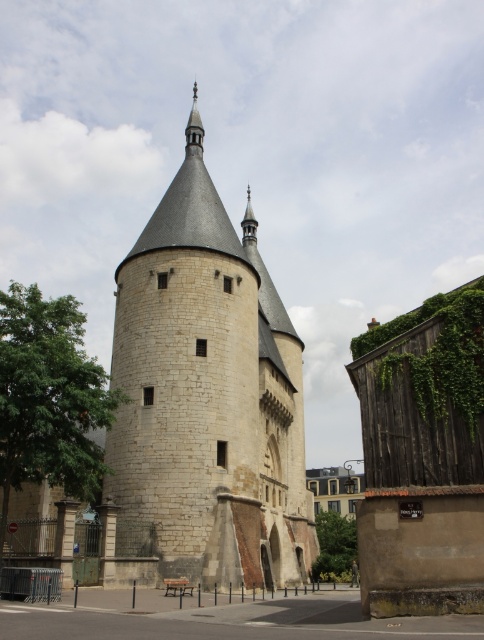
Can you confirm if stone tower at center is taller than green leafy ivy at right?

Yes.

Which is more to the left, stone tower at center or green leafy ivy at right?

From the viewer's perspective, stone tower at center appears more on the left side.

Locate an element on the screen. The image size is (484, 640). stone tower at center is located at coordinates (209, 394).